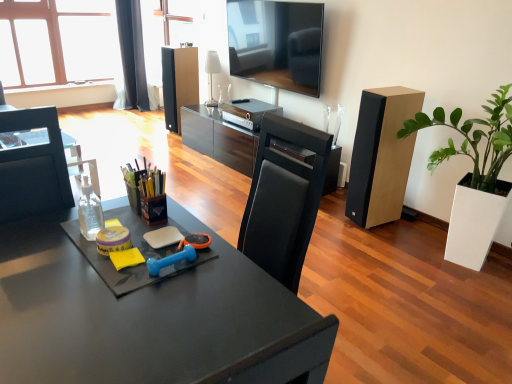
Question: Is matte black speaker at center, the first speaker in the top-to-bottom sequence, located within black fabric curtain at upper left?

Choices:
 (A) yes
 (B) no

Answer: (B)

Question: Does black fabric curtain at upper left have a lesser height compared to matte black speaker at center, the first speaker when ordered from back to front?

Choices:
 (A) yes
 (B) no

Answer: (B)

Question: From the image's perspective, would you say black fabric curtain at upper left is shown under matte black speaker at center, acting as the first speaker starting from the left?

Choices:
 (A) no
 (B) yes

Answer: (A)

Question: From a real-world perspective, does black fabric curtain at upper left sit lower than matte black speaker at center, the first speaker in the top-to-bottom sequence?

Choices:
 (A) yes
 (B) no

Answer: (B)

Question: Is black fabric curtain at upper left beside matte black speaker at center, acting as the first speaker starting from the left?

Choices:
 (A) yes
 (B) no

Answer: (B)

Question: Does black fabric curtain at upper left lie in front of matte black speaker at center, which is the 2th speaker from bottom to top?

Choices:
 (A) yes
 (B) no

Answer: (B)

Question: Is there a large distance between clear plastic bottle at left and light brown wood speaker at right, arranged as the first speaker when viewed from the right?

Choices:
 (A) no
 (B) yes

Answer: (B)

Question: Is clear plastic bottle at left aimed at light brown wood speaker at right, which ranks as the 2th speaker in top-to-bottom order?

Choices:
 (A) no
 (B) yes

Answer: (A)

Question: From the image's perspective, is clear plastic bottle at left on top of light brown wood speaker at right, placed as the first speaker when sorted from front to back?

Choices:
 (A) yes
 (B) no

Answer: (B)

Question: Can you confirm if clear plastic bottle at left is smaller than light brown wood speaker at right, the first speaker from the bottom?

Choices:
 (A) no
 (B) yes

Answer: (B)

Question: Is clear plastic bottle at left looking in the opposite direction of light brown wood speaker at right, acting as the second speaker starting from the back?

Choices:
 (A) yes
 (B) no

Answer: (A)

Question: Considering the relative positions of clear plastic bottle at left and light brown wood speaker at right, which ranks as the 2th speaker in left-to-right order, in the image provided, is clear plastic bottle at left to the left of light brown wood speaker at right, which ranks as the 2th speaker in left-to-right order, from the viewer's perspective?

Choices:
 (A) no
 (B) yes

Answer: (B)

Question: Are white glossy lamp at upper center and green matte plant at right beside each other?

Choices:
 (A) no
 (B) yes

Answer: (A)